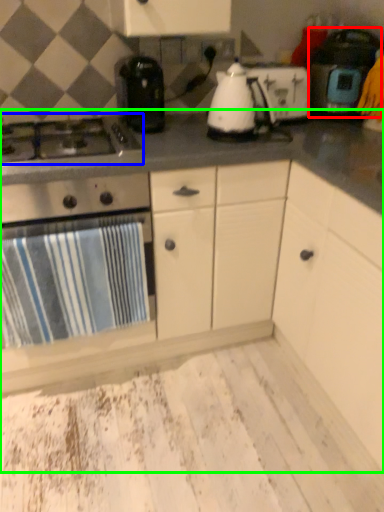
Question: Estimate the real-world distances between objects in this image. Which object is closer to kitchen appliance (highlighted by a red box), gas stove (highlighted by a blue box) or countertop (highlighted by a green box)?

Choices:
 (A) gas stove
 (B) countertop

Answer: (B)